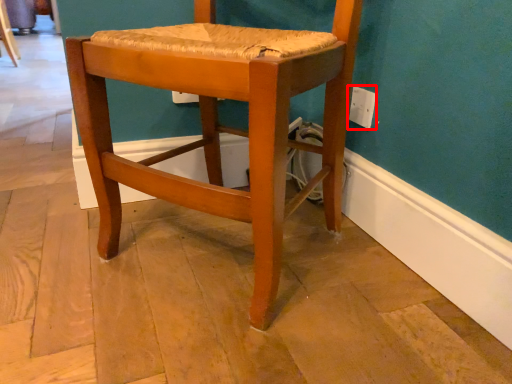
Question: Observing the image, what is the correct spatial positioning of electric outlet (annotated by the red box) in reference to chair?

Choices:
 (A) right
 (B) left

Answer: (A)